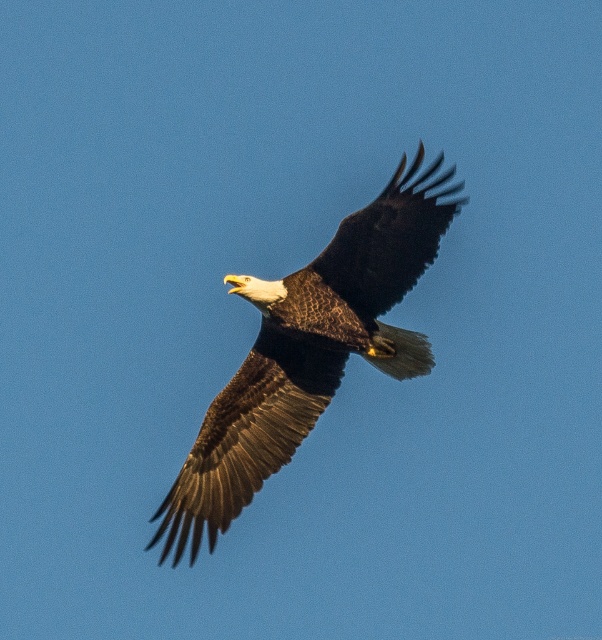
You are a wildlife photographer observing a bald eagle in flight. You notice two distinct feather groups on its wings and tail. The first group has brown textured feathers at center, and the second has dark brown feathers at center. Which of these feather groups is positioned lower on the eagle?

The brown textured feathers at center is located below dark brown feathers at center, so the brown textured feathers at center are positioned lower on the eagle.

You are a photographer trying to capture the bald eagle in the center of your image. According to the scene description, where exactly should you position your camera focus to ensure the brown textured feathers at center are perfectly centered?

To center the brown textured feathers at center, position your camera focus at the coordinates point (x=309, y=349) as specified in the scene description.